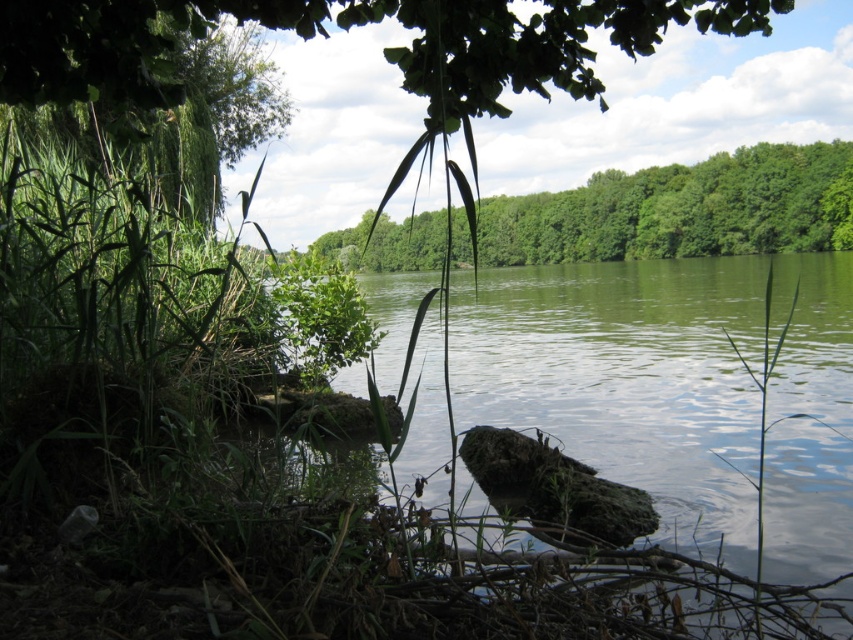
You are a hiker who wants to cross the lake but needs to place a 5 meter long wooden plank between the green mossy rock at center and the green leafy tree at center. Will the plank be long enough to bridge the gap between them?

The green mossy rock at center and green leafy tree at center are 5.29 meters apart from each other. The plank is 5 meters long, which is shorter than the distance between them. Therefore, the plank will not be long enough to bridge the gap between them.

You are standing at the lakeside and want to walk from the point at coordinates point (550, 404) to the point at coordinates point (416, 259). Which direction should you move relative to the other point?

You should move towards the point at coordinates point (416, 259), which is behind the point at coordinates point (550, 404).

Based on the photo, you are standing at the lakeside and want to take a photo of both the green mossy rock at center and the green leafy tree at center. Which object should you focus on first to ensure both are in clear view?

You should focus on the green mossy rock at center first because it is closer to you than the green leafy tree at center. By focusing on the closer object, both will be in acceptable focus if they are within the depth of field range.